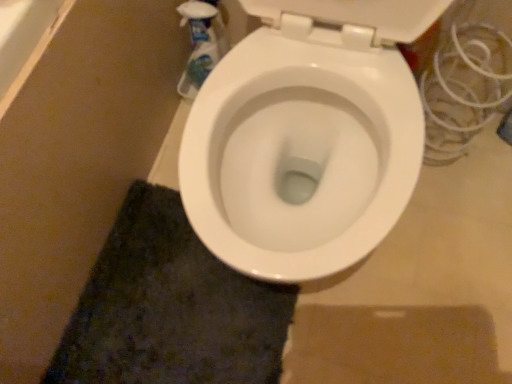
The width and height of the screenshot is (512, 384). What are the coordinates of `free location to the right of dark green shaggy carpet at lower left` in the screenshot? It's located at (388, 306).